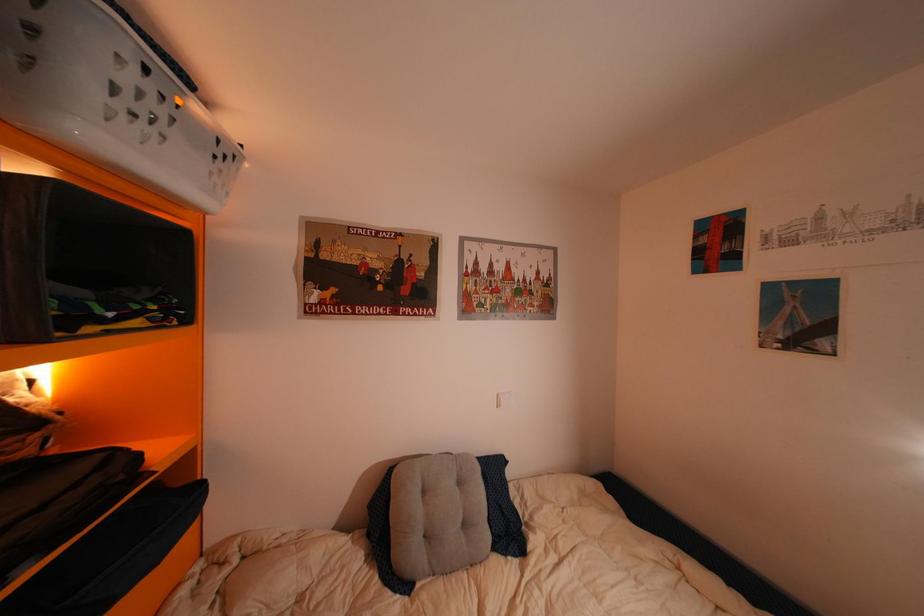
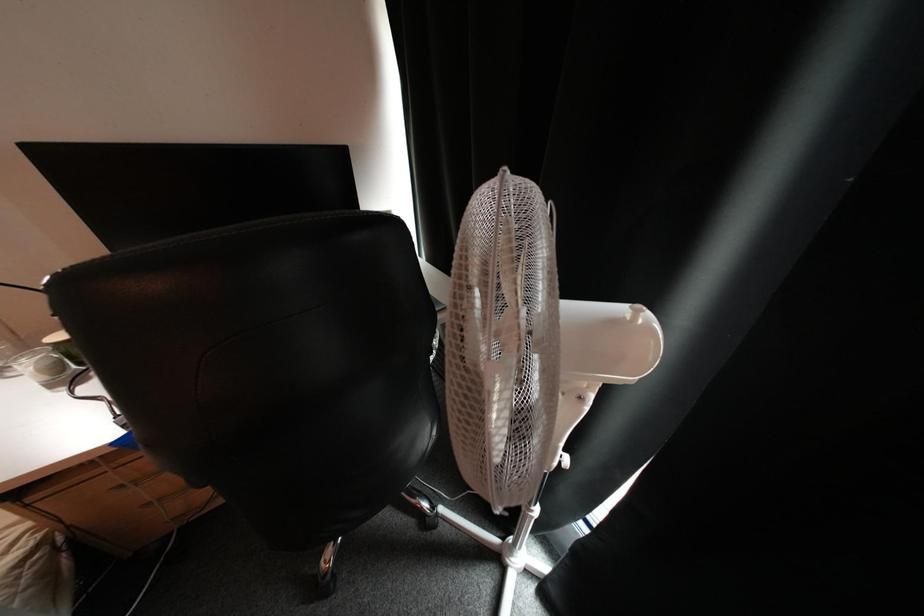
How did the camera likely rotate?

The rotation direction of the camera is right-down.